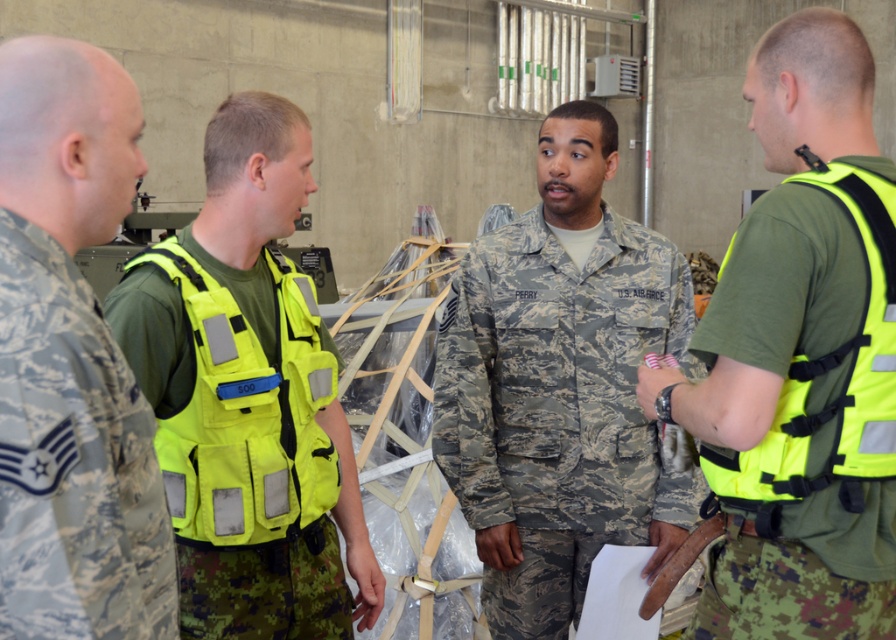
You are a new recruit in the military base and you see the neon yellow vest at right and the camouflage uniform at center. Which piece of clothing is covering part of the other?

The neon yellow vest at right is positioned over the camouflage uniform at center, meaning it is covering part of it.

You are a military planner who needs to hand a document to someone. You are standing near the neon yellow vest at right and the camouflage uniform at center. Which person is closer to you?

The camouflage uniform at center is closer to you since they are only 19.80 inches apart from the neon yellow vest at right.